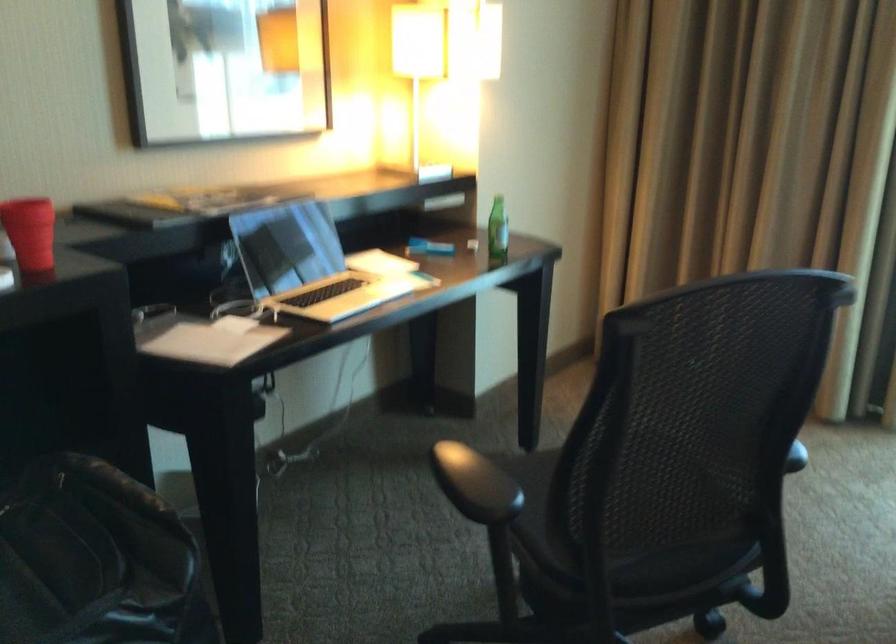
Locate an element on the screen. The width and height of the screenshot is (896, 644). pair of eyeglasses is located at coordinates (x=237, y=304).